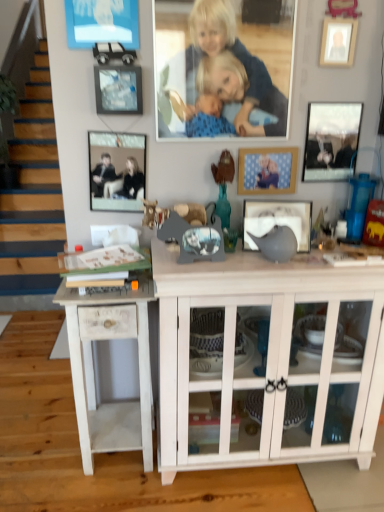
Question: Is blue fabric picture frame at center, which ranks as the 4th picture frame in right-to-left order, looking in the opposite direction of white wood side table at lower left?

Choices:
 (A) yes
 (B) no

Answer: (B)

Question: Is blue fabric picture frame at center, which is the third picture frame in left-to-right order, completely or partially outside of white wood side table at lower left?

Choices:
 (A) no
 (B) yes

Answer: (B)

Question: Considering the relative positions of blue fabric picture frame at center, which ranks as the 4th picture frame in right-to-left order, and white wood side table at lower left in the image provided, is blue fabric picture frame at center, which ranks as the 4th picture frame in right-to-left order, to the right of white wood side table at lower left from the viewer's perspective?

Choices:
 (A) yes
 (B) no

Answer: (A)

Question: From a real-world perspective, is blue fabric picture frame at center, which ranks as the 4th picture frame in right-to-left order, beneath white wood side table at lower left?

Choices:
 (A) no
 (B) yes

Answer: (A)

Question: From a real-world perspective, is blue fabric picture frame at center, which is the third picture frame in left-to-right order, located higher than white wood side table at lower left?

Choices:
 (A) yes
 (B) no

Answer: (A)

Question: Is blue fabric picture frame at center, which is the third picture frame in left-to-right order, thinner than white wood side table at lower left?

Choices:
 (A) yes
 (B) no

Answer: (A)

Question: Is matte black picture frame at center, the fourth picture frame in the left-to-right sequence, completely or partially outside of white wood cabinet at center?

Choices:
 (A) no
 (B) yes

Answer: (B)

Question: Is matte black picture frame at center, which appears as the 3th picture frame when viewed from the right, beside white wood cabinet at center?

Choices:
 (A) no
 (B) yes

Answer: (A)

Question: Does matte black picture frame at center, the fourth picture frame in the left-to-right sequence, have a greater height compared to white wood cabinet at center?

Choices:
 (A) no
 (B) yes

Answer: (A)

Question: From the image's perspective, would you say matte black picture frame at center, which appears as the 3th picture frame when viewed from the right, is positioned over white wood cabinet at center?

Choices:
 (A) no
 (B) yes

Answer: (B)

Question: From a real-world perspective, is matte black picture frame at center, which appears as the 3th picture frame when viewed from the right, below white wood cabinet at center?

Choices:
 (A) no
 (B) yes

Answer: (A)

Question: Is matte black picture frame at center, which appears as the 3th picture frame when viewed from the right, to the left of white wood cabinet at center from the viewer's perspective?

Choices:
 (A) no
 (B) yes

Answer: (A)

Question: Are blue fabric blanket at upper center and blue fabric picture frame at center, which is the third picture frame in left-to-right order, far apart?

Choices:
 (A) yes
 (B) no

Answer: (B)